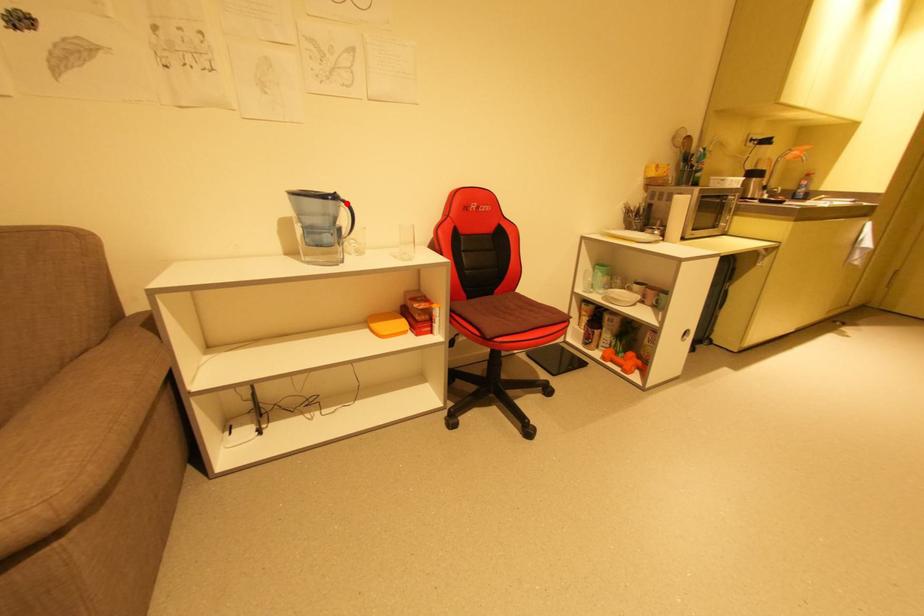
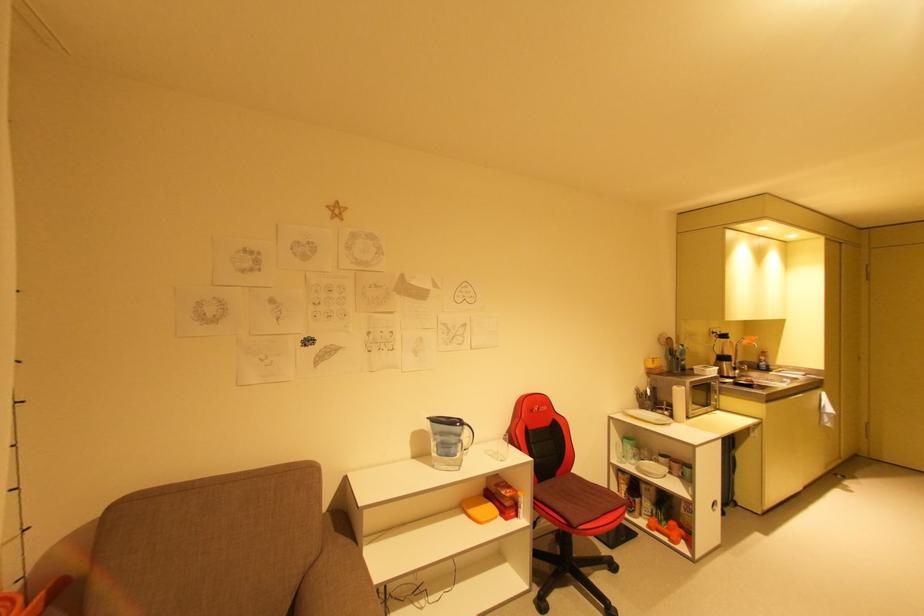
Question: I am providing you with two images of the same scene from different viewpoints. A red point is marked on the first image. Is the red point's position out of view in image 2?

Choices:
 (A) Yes
 (B) No

Answer: (B)